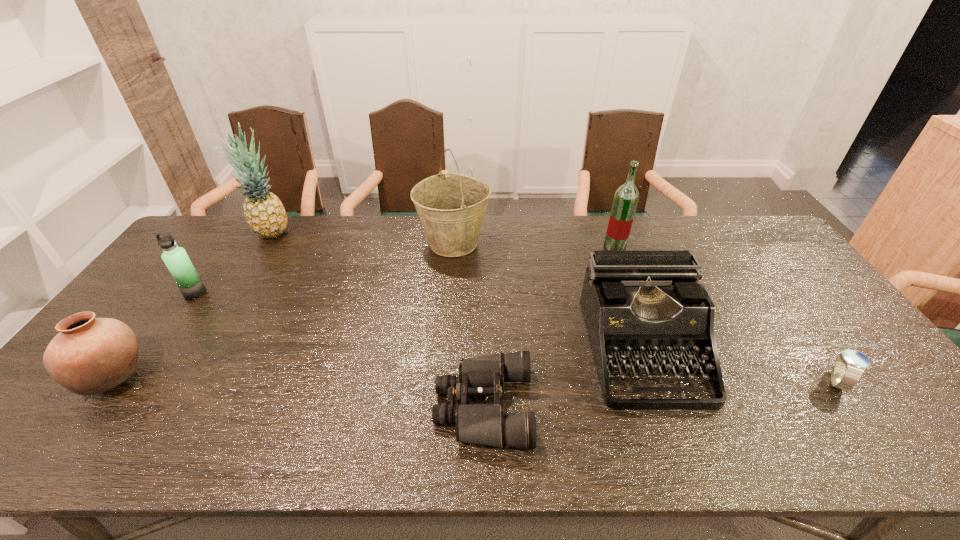
You are a GUI agent. You are given a task and a screenshot of the screen. Output one action in this format:
    pyautogui.click(x=<x>, y=<y>)
    Task: Click on the vacant region located 0.130m on the back of the liquor
    The image size is (960, 540).
    Given the screenshot: What is the action you would take?
    pyautogui.click(x=604, y=219)

You are a GUI agent. You are given a task and a screenshot of the screen. Output one action in this format:
    pyautogui.click(x=<x>, y=<y>)
    Task: Click on the free space located on the front of the thermos bottle
    The width and height of the screenshot is (960, 540).
    Given the screenshot: What is the action you would take?
    pyautogui.click(x=175, y=322)

What are the coordinates of `free location located on the typing side of the typewriter` in the screenshot? It's located at (679, 451).

Where is `free space located 0.280m on the back of the pottery`? free space located 0.280m on the back of the pottery is located at coordinates (187, 280).

This screenshot has height=540, width=960. Find the location of `free region located on the left of the watch`. free region located on the left of the watch is located at coordinates (769, 382).

Where is `free space located through the eyepieces of the binoculars`? free space located through the eyepieces of the binoculars is located at coordinates (367, 407).

Where is `vacant space situated 0.060m through the eyepieces of the binoculars`? This screenshot has height=540, width=960. vacant space situated 0.060m through the eyepieces of the binoculars is located at coordinates (409, 407).

Where is `vacant space located through the eyepieces of the binoculars`? The height and width of the screenshot is (540, 960). vacant space located through the eyepieces of the binoculars is located at coordinates (409, 407).

Image resolution: width=960 pixels, height=540 pixels. What are the coordinates of `pineapple that is at the far edge` in the screenshot? It's located at (264, 212).

The height and width of the screenshot is (540, 960). In order to click on wine bucket situated at the far edge in this screenshot , I will do `click(451, 207)`.